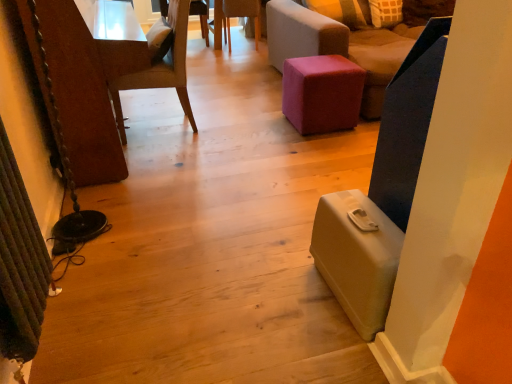
This screenshot has width=512, height=384. What do you see at coordinates (233, 17) in the screenshot?
I see `wooden chair at center, acting as the third chair starting from the left` at bounding box center [233, 17].

Identify the location of purple fabric ottoman at center, the first chair when ordered from right to left. (339, 46).

What do you see at coordinates (339, 46) in the screenshot? I see `purple fabric ottoman at center, which ranks as the 4th chair in left-to-right order` at bounding box center [339, 46].

I want to click on light brown wood chair at left, placed as the 2th chair when sorted from left to right, so click(x=161, y=68).

Looking at this image, what is the approximate width of matte green suitcase at lower right?

matte green suitcase at lower right is 19.60 inches wide.

Identify the location of wooden textured chair at upper center, which is the first chair from left to right. This screenshot has height=384, width=512. (201, 16).

From the image's perspective, which one is positioned higher, purple fabric ottoman at center, the first chair when ordered from right to left, or matte green suitcase at lower right?

purple fabric ottoman at center, the first chair when ordered from right to left, from the image's perspective.

Based on the photo, is purple fabric ottoman at center, which ranks as the 4th chair in left-to-right order, shorter than matte green suitcase at lower right?

No.

Considering the positions of point (362, 105) and point (332, 193), is point (362, 105) closer or farther from the camera than point (332, 193)?

Point (362, 105).

Looking at this image, considering the sizes of objects wooden chair at center, acting as the third chair starting from the left, and purple fabric ottoman at center, which ranks as the 4th chair in left-to-right order, in the image provided, who is wider, wooden chair at center, acting as the third chair starting from the left, or purple fabric ottoman at center, which ranks as the 4th chair in left-to-right order,?

purple fabric ottoman at center, which ranks as the 4th chair in left-to-right order, is wider.

Which of these two, wooden chair at center, arranged as the second chair when viewed from the right, or purple fabric ottoman at center, which ranks as the 4th chair in left-to-right order, is smaller?

Smaller between the two is wooden chair at center, arranged as the second chair when viewed from the right.

Is wooden chair at center, arranged as the second chair when viewed from the right, completely or partially outside of purple fabric ottoman at center, the first chair when ordered from right to left?

Yes, wooden chair at center, arranged as the second chair when viewed from the right, is outside of purple fabric ottoman at center, the first chair when ordered from right to left.

Is wooden textured chair at upper center, which is the first chair from left to right, to the left of light brown wood chair at left, positioned as the third chair in right-to-left order, from the viewer's perspective?

Yes, wooden textured chair at upper center, which is the first chair from left to right, is to the left of light brown wood chair at left, positioned as the third chair in right-to-left order.

Consider the image. Considering the sizes of objects wooden textured chair at upper center, which is counted as the fourth chair, starting from the right, and light brown wood chair at left, placed as the 2th chair when sorted from left to right, in the image provided, who is smaller, wooden textured chair at upper center, which is counted as the fourth chair, starting from the right, or light brown wood chair at left, placed as the 2th chair when sorted from left to right,?

Smaller between the two is wooden textured chair at upper center, which is counted as the fourth chair, starting from the right.

Is light brown wood chair at left, placed as the 2th chair when sorted from left to right, located within wooden textured chair at upper center, which is counted as the fourth chair, starting from the right?

No, light brown wood chair at left, placed as the 2th chair when sorted from left to right, is not a part of wooden textured chair at upper center, which is counted as the fourth chair, starting from the right.

Can you confirm if wooden textured chair at upper center, which is the first chair from left to right, is thinner than light brown wood chair at left, positioned as the third chair in right-to-left order?

In fact, wooden textured chair at upper center, which is the first chair from left to right, might be wider than light brown wood chair at left, positioned as the third chair in right-to-left order.

From their relative heights in the image, would you say velvet pink ottoman at center is taller or shorter than matte green suitcase at lower right?

Clearly, velvet pink ottoman at center is taller compared to matte green suitcase at lower right.

Can you tell me how much velvet pink ottoman at center and matte green suitcase at lower right differ in facing direction?

The angular difference between velvet pink ottoman at center and matte green suitcase at lower right is 91.5 degrees.

Is velvet pink ottoman at center outside of matte green suitcase at lower right?

That's correct, velvet pink ottoman at center is outside of matte green suitcase at lower right.

From the image's perspective, does matte green suitcase at lower right appear higher than wooden textured chair at upper center, which is the first chair from left to right?

No, from the image's perspective, matte green suitcase at lower right is not on top of wooden textured chair at upper center, which is the first chair from left to right.

How distant is matte green suitcase at lower right from wooden textured chair at upper center, which is the first chair from left to right?

They are 4.03 meters apart.

Between matte green suitcase at lower right and wooden textured chair at upper center, which is the first chair from left to right, which one has larger width?

With larger width is wooden textured chair at upper center, which is the first chair from left to right.

From the image's perspective, which is above, matte green suitcase at lower right or light brown wood chair at left, placed as the 2th chair when sorted from left to right?

light brown wood chair at left, placed as the 2th chair when sorted from left to right, appears higher in the image.

Is matte green suitcase at lower right not inside light brown wood chair at left, placed as the 2th chair when sorted from left to right?

Yes, matte green suitcase at lower right is outside of light brown wood chair at left, placed as the 2th chair when sorted from left to right.

In the scene shown: Can you confirm if matte green suitcase at lower right is thinner than light brown wood chair at left, positioned as the third chair in right-to-left order?

Yes.

Can you tell me how much matte green suitcase at lower right and light brown wood chair at left, placed as the 2th chair when sorted from left to right, differ in facing direction?

matte green suitcase at lower right and light brown wood chair at left, placed as the 2th chair when sorted from left to right, are facing 89.1 degrees away from each other.

Which of these two, light brown wood chair at left, placed as the 2th chair when sorted from left to right, or wooden textured chair at upper center, which is the first chair from left to right, is smaller?

wooden textured chair at upper center, which is the first chair from left to right.

Is point (179, 42) more distant than point (207, 33)?

No, it is in front of (207, 33).

From a real-world perspective, between light brown wood chair at left, placed as the 2th chair when sorted from left to right, and wooden textured chair at upper center, which is counted as the fourth chair, starting from the right, who is vertically lower?

In real-world perspective, wooden textured chair at upper center, which is counted as the fourth chair, starting from the right, is lower.

Where is `chair that is the 3rd one above the matte green suitcase at lower right (from a real-world perspective)`? The width and height of the screenshot is (512, 384). chair that is the 3rd one above the matte green suitcase at lower right (from a real-world perspective) is located at coordinates (339, 46).

You are a GUI agent. You are given a task and a screenshot of the screen. Output one action in this format:
    pyautogui.click(x=<x>, y=<y>)
    Task: Click on the 1st chair in front of the wooden chair at center, acting as the third chair starting from the left
    
    Given the screenshot: What is the action you would take?
    pyautogui.click(x=339, y=46)

From the image, which object appears to be farther from light brown wood chair at left, placed as the 2th chair when sorted from left to right, velvet pink ottoman at center or purple fabric ottoman at center, the first chair when ordered from right to left?

The object further to light brown wood chair at left, placed as the 2th chair when sorted from left to right, is purple fabric ottoman at center, the first chair when ordered from right to left.

Based on the photo, looking at the image, which one is located further to light brown wood chair at left, placed as the 2th chair when sorted from left to right, matte green suitcase at lower right or purple fabric ottoman at center, which ranks as the 4th chair in left-to-right order?

Among the two, matte green suitcase at lower right is located further to light brown wood chair at left, placed as the 2th chair when sorted from left to right.

Which object lies nearer to the anchor point wooden chair at center, arranged as the second chair when viewed from the right, purple fabric ottoman at center, which ranks as the 4th chair in left-to-right order, or velvet pink ottoman at center?

Based on the image, purple fabric ottoman at center, which ranks as the 4th chair in left-to-right order, appears to be nearer to wooden chair at center, arranged as the second chair when viewed from the right.

Considering their positions, is velvet pink ottoman at center positioned closer to matte green suitcase at lower right than light brown wood chair at left, positioned as the third chair in right-to-left order?

Among the two, velvet pink ottoman at center is located nearer to matte green suitcase at lower right.

When comparing their distances from velvet pink ottoman at center, does matte green suitcase at lower right or wooden chair at center, arranged as the second chair when viewed from the right, seem closer?

Among the two, matte green suitcase at lower right is located nearer to velvet pink ottoman at center.

Considering their positions, is matte green suitcase at lower right positioned further to wooden chair at center, acting as the third chair starting from the left, than velvet pink ottoman at center?

Among the two, matte green suitcase at lower right is located further to wooden chair at center, acting as the third chair starting from the left.

Looking at the image, which one is located closer to matte green suitcase at lower right, wooden textured chair at upper center, which is counted as the fourth chair, starting from the right, or purple fabric ottoman at center, which ranks as the 4th chair in left-to-right order?

Based on the image, purple fabric ottoman at center, which ranks as the 4th chair in left-to-right order, appears to be nearer to matte green suitcase at lower right.

Based on their spatial positions, is matte green suitcase at lower right or wooden chair at center, arranged as the second chair when viewed from the right, further from light brown wood chair at left, placed as the 2th chair when sorted from left to right?

wooden chair at center, arranged as the second chair when viewed from the right, is positioned further to the anchor light brown wood chair at left, placed as the 2th chair when sorted from left to right.

The width and height of the screenshot is (512, 384). What are the coordinates of `furniture positioned between purple fabric ottoman at center, which ranks as the 4th chair in left-to-right order, and wooden chair at center, acting as the third chair starting from the left, from near to far` in the screenshot? It's located at (322, 93).

The image size is (512, 384). What are the coordinates of `furniture positioned between light brown wood chair at left, placed as the 2th chair when sorted from left to right, and wooden chair at center, acting as the third chair starting from the left, from near to far` in the screenshot? It's located at (322, 93).

The image size is (512, 384). In order to click on furniture between matte green suitcase at lower right and wooden chair at center, acting as the third chair starting from the left, in the front-back direction in this screenshot , I will do `click(322, 93)`.

The image size is (512, 384). Identify the location of furniture between matte green suitcase at lower right and wooden textured chair at upper center, which is the first chair from left to right, from front to back. (322, 93).